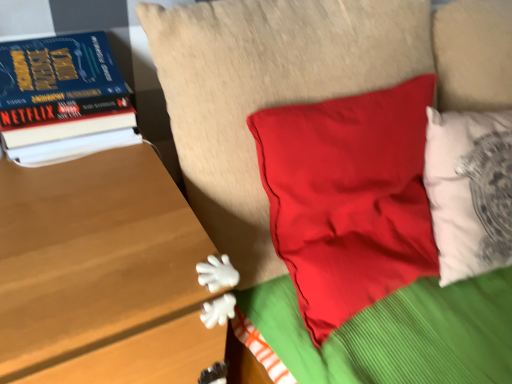
The height and width of the screenshot is (384, 512). What are the coordinates of `vacant area that is in front of hardcover book at left` in the screenshot? It's located at (71, 213).